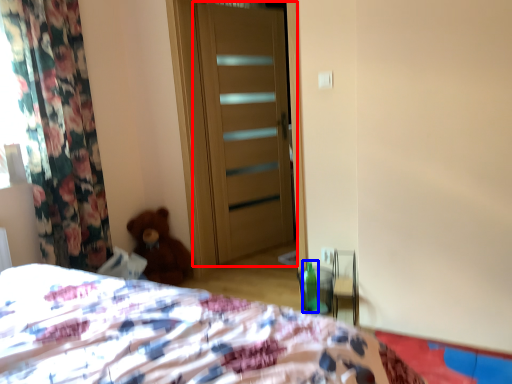
Question: Which of the following is the closest to the observer, door (highlighted by a red box) or bottle (highlighted by a blue box)?

Choices:
 (A) door
 (B) bottle

Answer: (B)